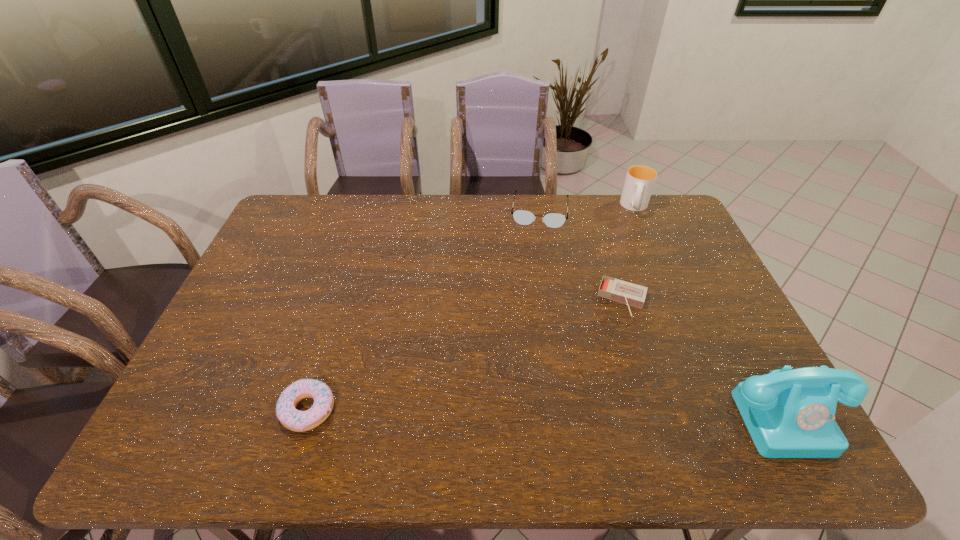
Find the location of a particular element. Image resolution: width=960 pixels, height=540 pixels. doughnut at the near edge is located at coordinates (299, 421).

The height and width of the screenshot is (540, 960). Identify the location of telephone located at the near edge. (789, 413).

This screenshot has width=960, height=540. Find the location of `telephone at the right edge`. telephone at the right edge is located at coordinates (789, 413).

The width and height of the screenshot is (960, 540). What are the coordinates of `cup located at the right edge` in the screenshot? It's located at tap(640, 180).

What are the coordinates of `object at the far right corner` in the screenshot? It's located at (640, 180).

Where is `object present at the near right corner`? The width and height of the screenshot is (960, 540). object present at the near right corner is located at coordinates (789, 413).

In the image, there is a desktop. At what (x,y) coordinates should I click in order to perform the action: click on blank space at the far edge. Please return your answer as a coordinate pair (x, y). Looking at the image, I should click on (420, 211).

Image resolution: width=960 pixels, height=540 pixels. Identify the location of vacant space at the near edge. (685, 386).

At what (x,y) coordinates should I click in order to perform the action: click on vacant space at the left edge of the desktop. Please return your answer as a coordinate pair (x, y). This screenshot has height=540, width=960. Looking at the image, I should click on (197, 372).

Find the location of `vacant space at the right edge`. vacant space at the right edge is located at coordinates (679, 248).